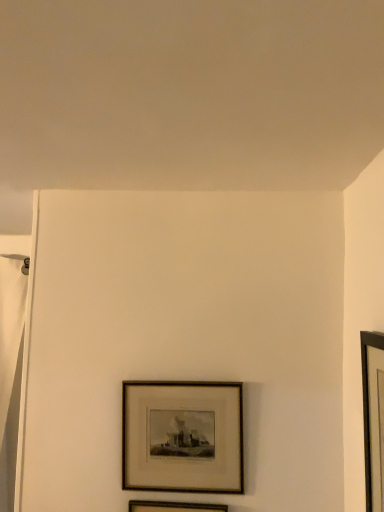
At what (x,y) coordinates should I click in order to perform the action: click on wooden framed print at center. Please return your answer as a coordinate pair (x, y). Looking at the image, I should click on (182, 437).

What do you see at coordinates (182, 437) in the screenshot?
I see `wooden framed print at center` at bounding box center [182, 437].

The image size is (384, 512). In order to click on wooden framed print at center in this screenshot , I will do `click(182, 437)`.